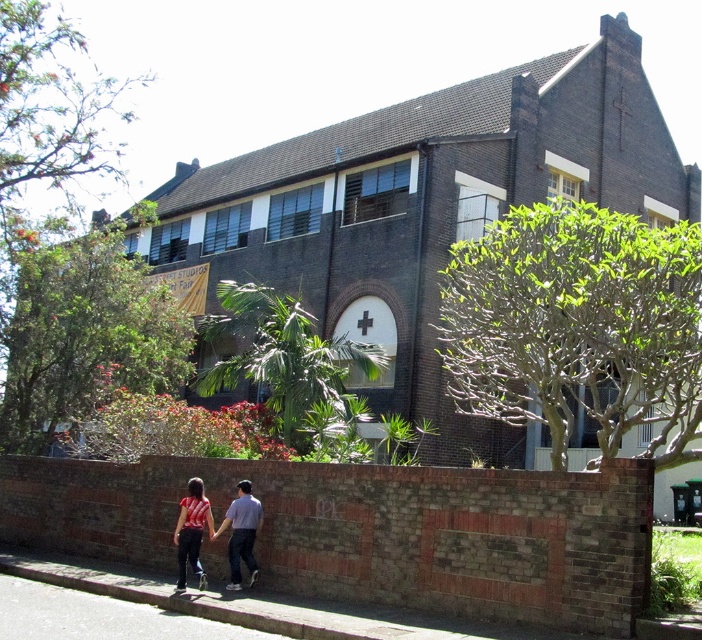
You are standing in front of the large brick building with a cross above the arched window. You see a point marked at coordinates (216, 531). What object is located at that point?

The point at coordinates (216, 531) indicates the location of the matte red shirt at lower center.

You are standing in front of the brick building and see two people walking near the wall. Which person is closer to you, the one wearing the matte red shirt at lower center or the striped fabric shirt at lower center?

The matte red shirt at lower center is closer to you because it is in front of the striped fabric shirt at lower center.